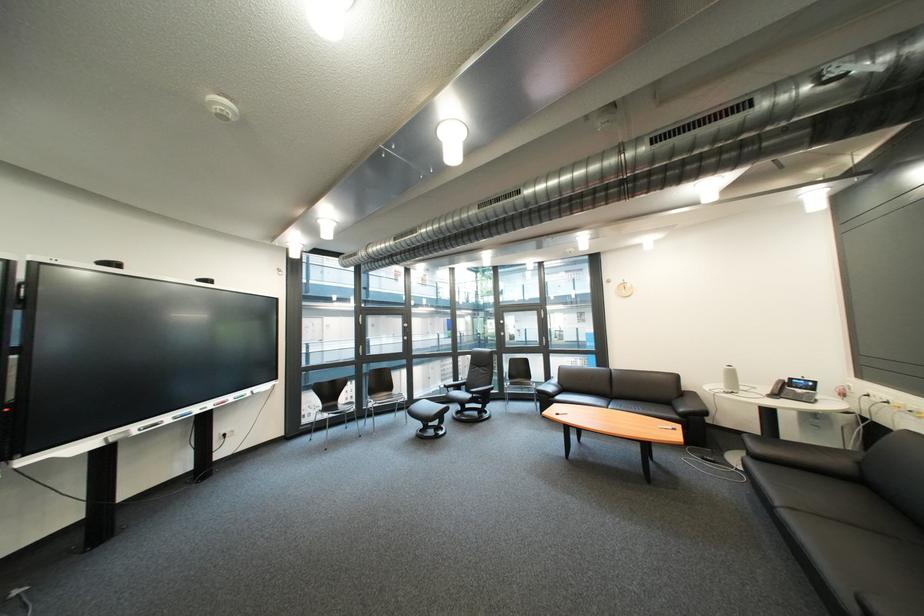
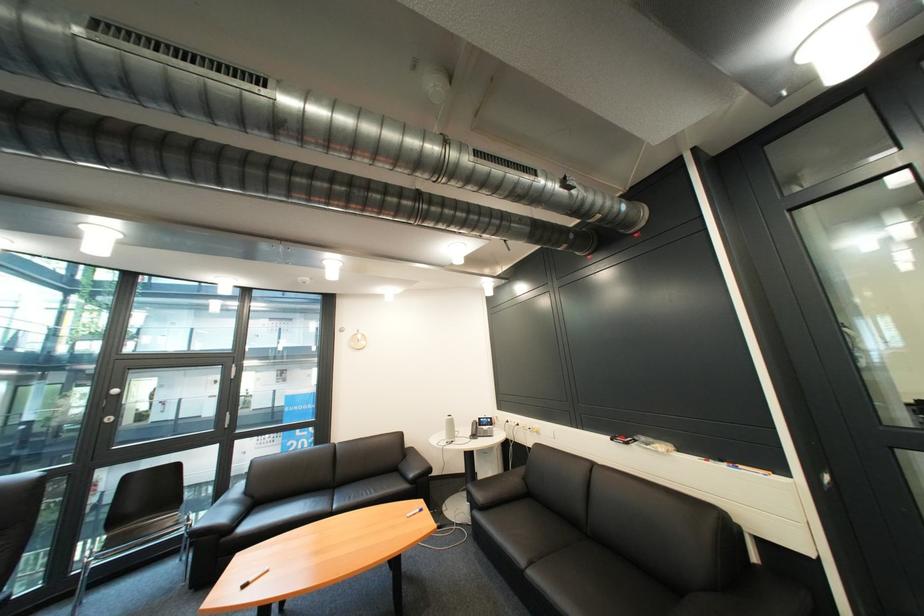
Find the pixel in the second image that matches [805,379] in the first image.

(492, 419)